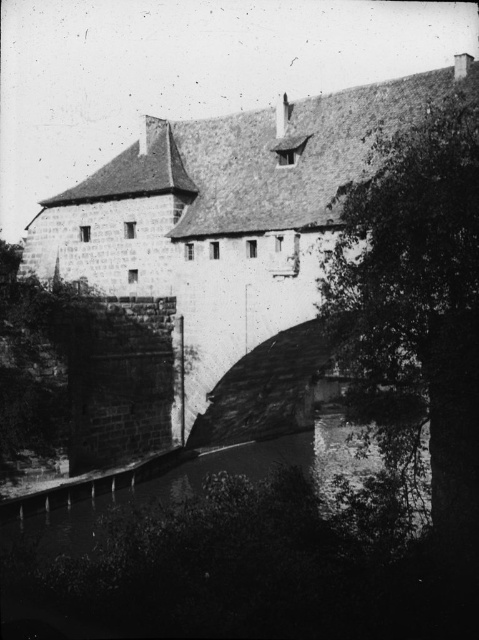
You are standing at the point marked as point (228, 214) in the image of the historical stone building. What object is located exactly at that point?

The stone wall at center is located exactly at point (228, 214).

You are an engineer assessing the feasibility of installing a footbridge between the stone wall at center and the green leafy tree at right. The footbridge requires a minimum clearance of 50 feet between the two points to be stable. Based on the scene, can the footbridge be safely constructed?

The distance between the stone wall at center and the green leafy tree at right is 47.58 feet, which is less than the required 50 feet clearance. Therefore, the footbridge cannot be safely constructed as it does not meet the minimum distance requirement.